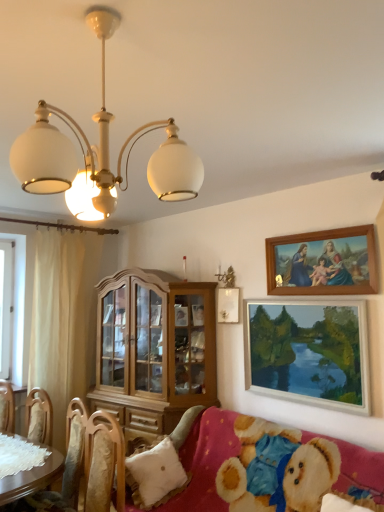
Question: Considering the relative positions of wooden chair at lower left and wooden picture frame at upper right, the 2th picture frame ordered from the bottom, in the image provided, is wooden chair at lower left to the left of wooden picture frame at upper right, the 2th picture frame ordered from the bottom, from the viewer's perspective?

Choices:
 (A) yes
 (B) no

Answer: (A)

Question: Does wooden chair at lower left have a smaller size compared to wooden picture frame at upper right, marked as the 1th picture frame in a top-to-bottom arrangement?

Choices:
 (A) no
 (B) yes

Answer: (A)

Question: Is wooden chair at lower left oriented away from wooden picture frame at upper right, marked as the 1th picture frame in a top-to-bottom arrangement?

Choices:
 (A) yes
 (B) no

Answer: (B)

Question: From a real-world perspective, is wooden chair at lower left physically below wooden picture frame at upper right, the 2th picture frame ordered from the bottom?

Choices:
 (A) yes
 (B) no

Answer: (A)

Question: Is the position of wooden chair at lower left more distant than that of wooden picture frame at upper right, the 2th picture frame ordered from the bottom?

Choices:
 (A) yes
 (B) no

Answer: (B)

Question: Based on their positions, is wooden picture frame at lower right, marked as the second picture frame in a top-to-bottom arrangement, located to the left or right of white fluffy pillow at lower left?

Choices:
 (A) left
 (B) right

Answer: (B)

Question: From the image's perspective, relative to white fluffy pillow at lower left, is wooden picture frame at lower right, marked as the second picture frame in a top-to-bottom arrangement, above or below?

Choices:
 (A) below
 (B) above

Answer: (B)

Question: Is point (249, 314) closer or farther from the camera than point (178, 474)?

Choices:
 (A) farther
 (B) closer

Answer: (A)

Question: Considering their positions, is wooden picture frame at lower right, marked as the second picture frame in a top-to-bottom arrangement, located in front of or behind white fluffy pillow at lower left?

Choices:
 (A) front
 (B) behind

Answer: (B)

Question: Considering the positions of wooden chair at lower left and beige fabric curtain at left in the image, is wooden chair at lower left wider or thinner than beige fabric curtain at left?

Choices:
 (A) thin
 (B) wide

Answer: (B)

Question: Choose the correct answer: Is wooden chair at lower left inside beige fabric curtain at left or outside it?

Choices:
 (A) inside
 (B) outside

Answer: (B)

Question: Is point (69, 460) positioned closer to the camera than point (61, 443)?

Choices:
 (A) closer
 (B) farther

Answer: (A)

Question: Considering the positions of wooden chair at lower left and beige fabric curtain at left in the image, is wooden chair at lower left bigger or smaller than beige fabric curtain at left?

Choices:
 (A) small
 (B) big

Answer: (A)

Question: From a real-world perspective, is wooden picture frame at lower right, the first picture frame from the bottom, physically located above or below beige fabric curtain at left?

Choices:
 (A) above
 (B) below

Answer: (A)

Question: In the image, is wooden picture frame at lower right, marked as the second picture frame in a top-to-bottom arrangement, positioned in front of or behind beige fabric curtain at left?

Choices:
 (A) behind
 (B) front

Answer: (B)